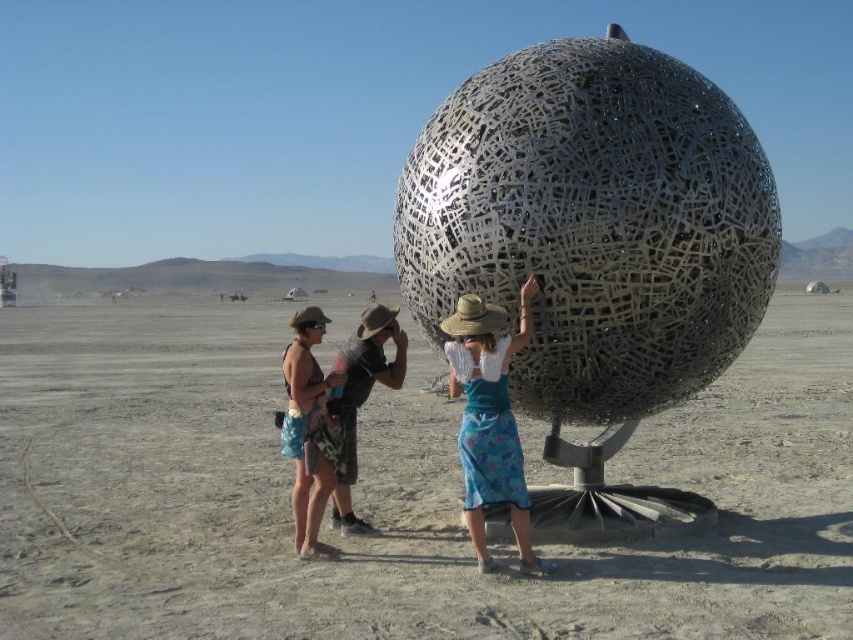
Looking at this image, you are standing in front of the desert sculpture and want to know which of the two points, point [445,353] or point [310,356], is closer to you. Can you determine this based on their positions?

Point [310,356] is closer to you because it is less further to the camera than point [445,353] according to the description.

You are a photographer trying to capture the metallic sphere sculpture. You notice two people wearing the blue floral skirt at center and the matte brown shorts at center. Which clothing item is positioned lower on their bodies?

The blue floral skirt at center is below matte brown shorts at center, so the skirt is positioned lower on their bodies than the shorts.